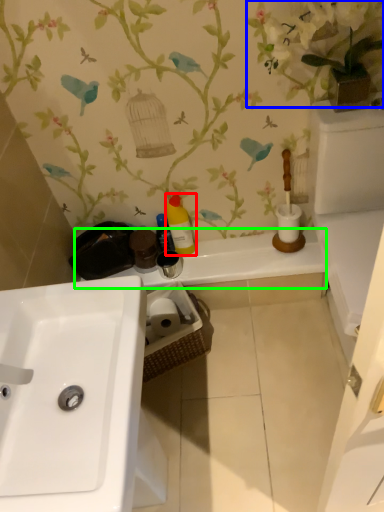
Question: Which object is the farthest from cleaning product (highlighted by a red box)? Choose among these: floral arrangement (highlighted by a blue box) or counter top (highlighted by a green box).

Choices:
 (A) floral arrangement
 (B) counter top

Answer: (A)